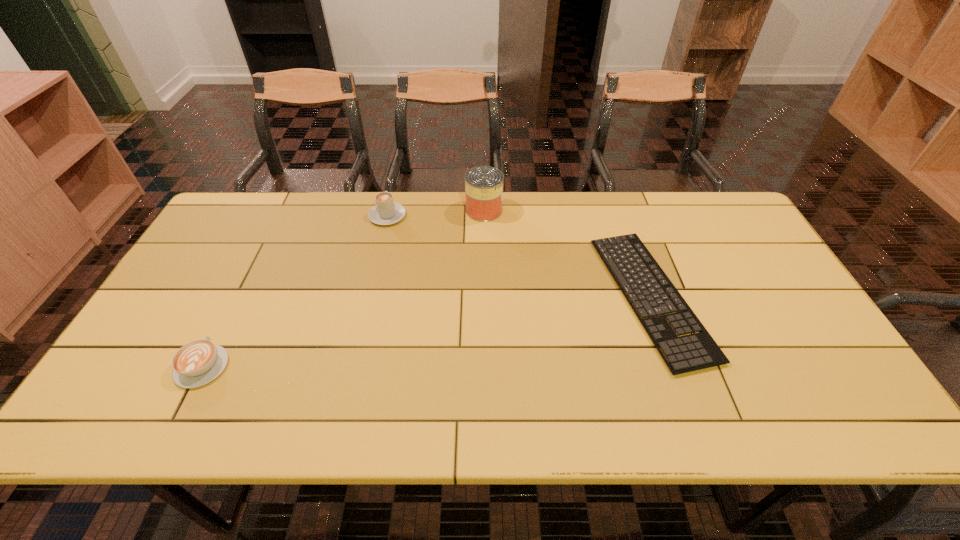
Where is `vacant space that is in between the second shortest object and the can`? Image resolution: width=960 pixels, height=540 pixels. vacant space that is in between the second shortest object and the can is located at coordinates tap(343, 288).

Identify the location of vacant space in between the rightmost object and the can. (567, 253).

Image resolution: width=960 pixels, height=540 pixels. What are the coordinates of `vacant space in between the shorter cappuccino and the can` in the screenshot? It's located at (343, 288).

Locate which object is the third closest to the second tallest object. Please provide its 2D coordinates. Your answer should be formatted as a tuple, i.e. [(x, y)], where the tuple contains the x and y coordinates of a point satisfying the conditions above.

[(696, 351)]

Select which object is the closest to the right cappuccino. Please provide its 2D coordinates. Your answer should be formatted as a tuple, i.e. [(x, y)], where the tuple contains the x and y coordinates of a point satisfying the conditions above.

[(483, 185)]

Where is `vacant region that satisfies the following two spatial constraints: 1. on the side of the tallest object with the handle; 2. on the left side of the leftmost object`? This screenshot has height=540, width=960. vacant region that satisfies the following two spatial constraints: 1. on the side of the tallest object with the handle; 2. on the left side of the leftmost object is located at coordinates (281, 210).

This screenshot has height=540, width=960. Identify the location of blank space that satisfies the following two spatial constraints: 1. on the front side of the shortest object; 2. on the left side of the tallest object. (485, 297).

Where is `free location that satisfies the following two spatial constraints: 1. on the side of the leftmost object with the handle; 2. on the left side of the shortest object`? The image size is (960, 540). free location that satisfies the following two spatial constraints: 1. on the side of the leftmost object with the handle; 2. on the left side of the shortest object is located at coordinates (237, 297).

This screenshot has height=540, width=960. I want to click on vacant space that satisfies the following two spatial constraints: 1. on the side of the second object from right to left with the handle; 2. on the left side of the leftmost object, so click(x=281, y=210).